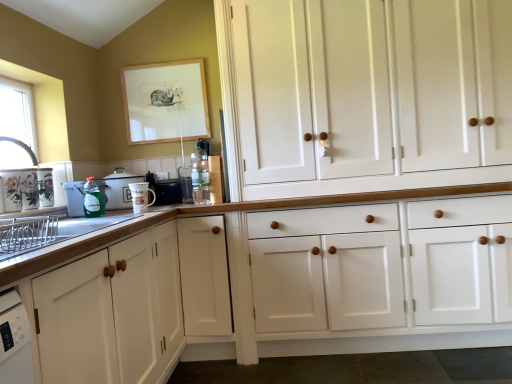
Locate an element on the screen. This screenshot has height=384, width=512. free space in front of metallic silver toaster at upper center, positioned as the 6th appliance in left-to-right order is located at coordinates (180, 198).